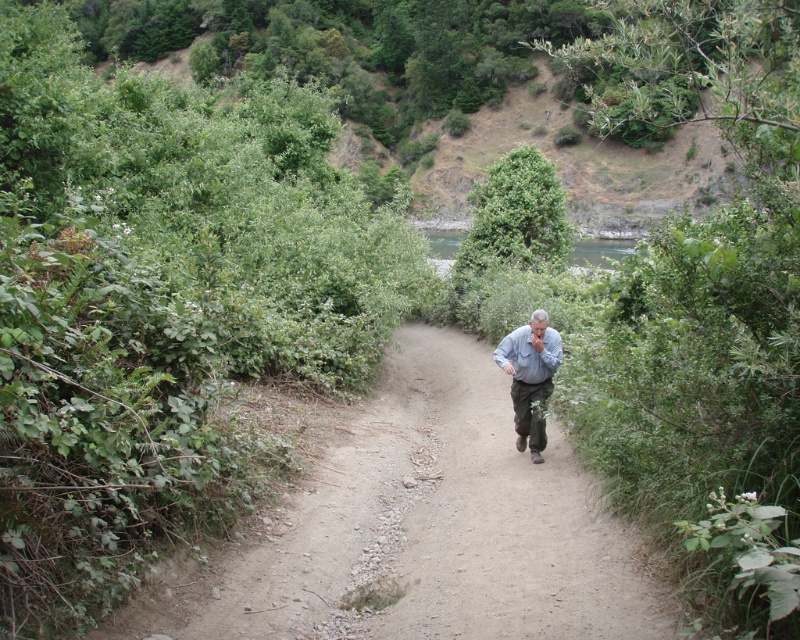
From the picture: Between dirt path at center and gray fabric shirt at center, which one has less height?

dirt path at center is shorter.

Does dirt path at center have a smaller size compared to gray fabric shirt at center?

Incorrect, dirt path at center is not smaller in size than gray fabric shirt at center.

Is point (550, 492) positioned in front of point (524, 356)?

Yes, it is.

I want to click on dirt path at center, so click(421, 529).